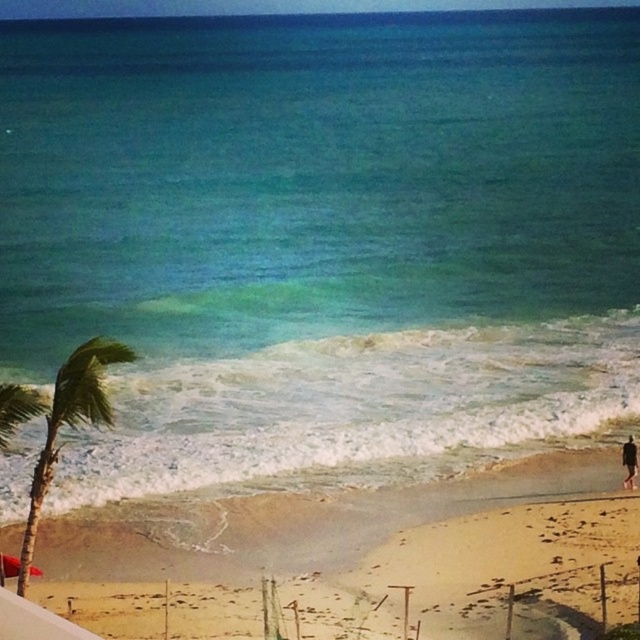
Question: Among these objects, which one is farthest from the camera?

Choices:
 (A) black fabric person at lower right
 (B) green leafy palm tree at left

Answer: (A)

Question: Is sandy beach at lower center closer to camera compared to black fabric person at lower right?

Choices:
 (A) no
 (B) yes

Answer: (B)

Question: Can you confirm if sandy beach at lower center is wider than green leafy palm tree at left?

Choices:
 (A) no
 (B) yes

Answer: (B)

Question: Is sandy beach at lower center closer to camera compared to green leafy palm tree at left?

Choices:
 (A) no
 (B) yes

Answer: (A)

Question: Which of the following is the farthest from the observer?

Choices:
 (A) (513, 476)
 (B) (51, 468)

Answer: (A)

Question: Estimate the real-world distances between objects in this image. Which object is closer to the green leafy palm tree at left?

Choices:
 (A) black fabric person at lower right
 (B) sandy beach at lower center

Answer: (B)